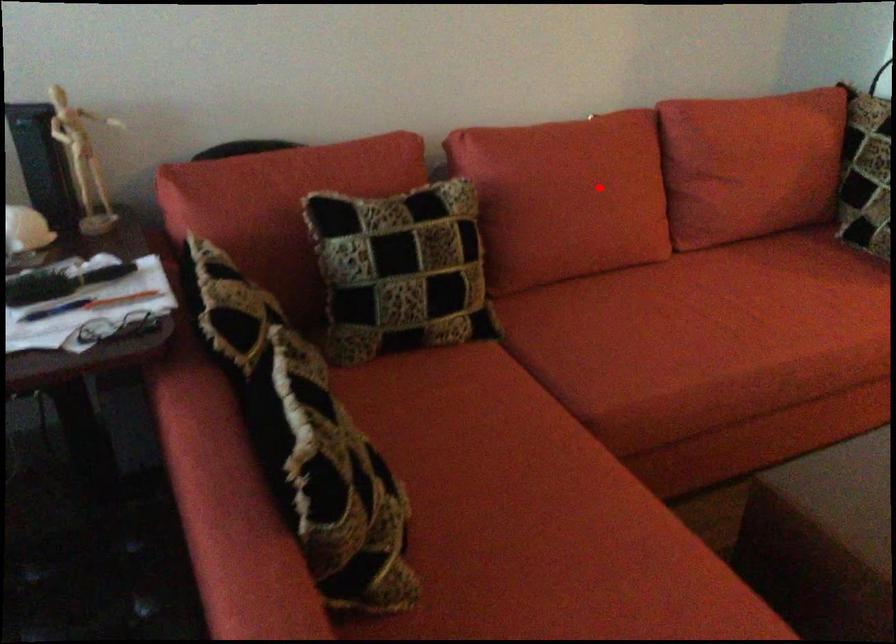
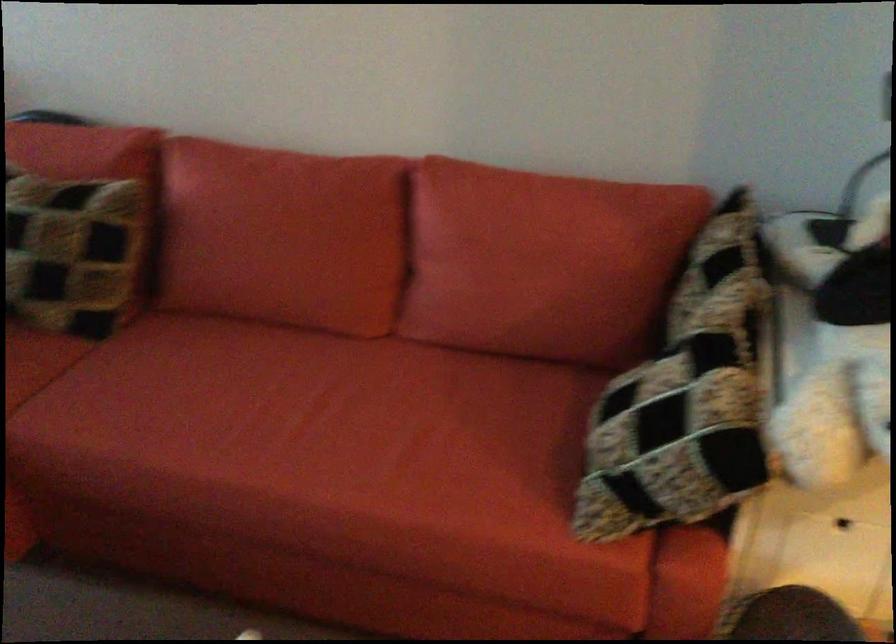
Locate, in the second image, the point that corresponds to the highlighted location in the first image.

(282, 236)